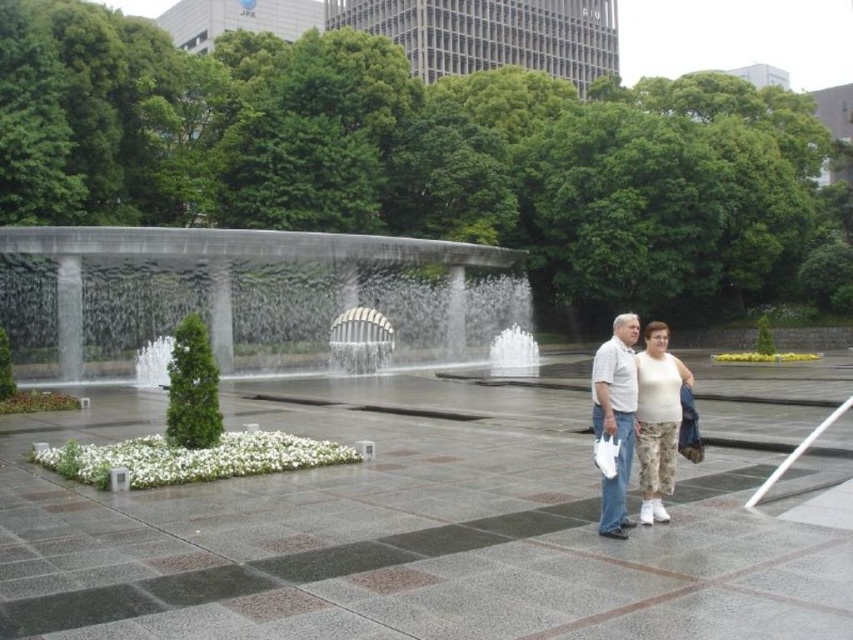
Is gray concrete waterfall at center thinner than white cotton tank top at lower right?

Incorrect, gray concrete waterfall at center's width is not less than white cotton tank top at lower right's.

At what (x,y) coordinates should I click in order to perform the action: click on gray concrete waterfall at center. Please return your answer as a coordinate pair (x, y). The width and height of the screenshot is (853, 640). Looking at the image, I should click on (242, 296).

Does point (450, 282) come farther from viewer compared to point (653, 346)?

That is True.

Locate an element on the screen. This screenshot has width=853, height=640. gray concrete waterfall at center is located at coordinates (242, 296).

Does white cotton tank top at lower right come in front of white cotton shirt at center?

No, white cotton tank top at lower right is behind white cotton shirt at center.

Does white cotton tank top at lower right have a lesser height compared to white cotton shirt at center?

Correct, white cotton tank top at lower right is not as tall as white cotton shirt at center.

Who is more distant from viewer, (672,387) or (619,481)?

The point (672,387) is behind.

This screenshot has height=640, width=853. In order to click on white cotton tank top at lower right in this screenshot , I will do `click(657, 420)`.

Who is taller, gray concrete waterfall at center or white cotton shirt at center?

With more height is gray concrete waterfall at center.

In the scene shown: Between gray concrete waterfall at center and white cotton shirt at center, which one has less height?

white cotton shirt at center

The width and height of the screenshot is (853, 640). Describe the element at coordinates (242, 296) in the screenshot. I see `gray concrete waterfall at center` at that location.

The width and height of the screenshot is (853, 640). Find the location of `gray concrete waterfall at center`. gray concrete waterfall at center is located at coordinates (242, 296).